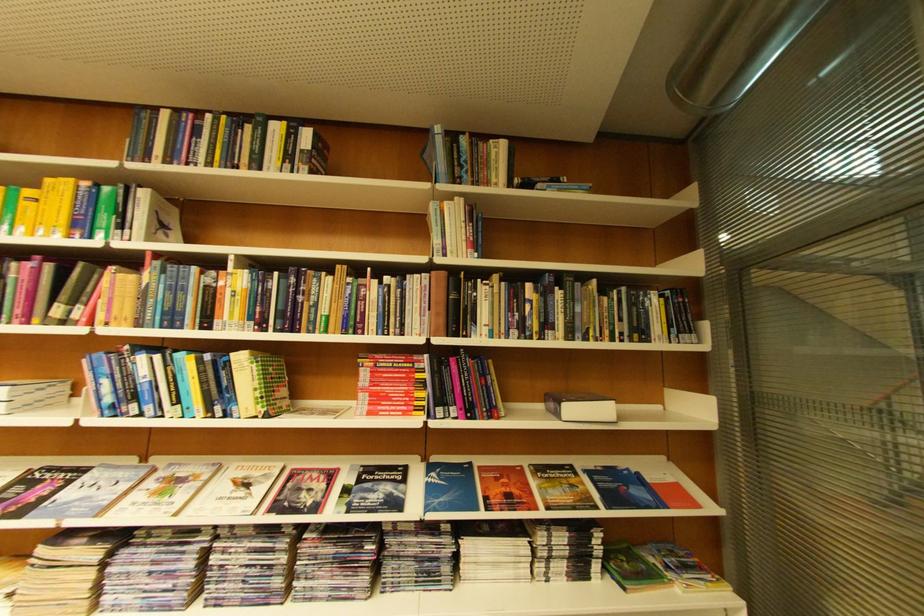
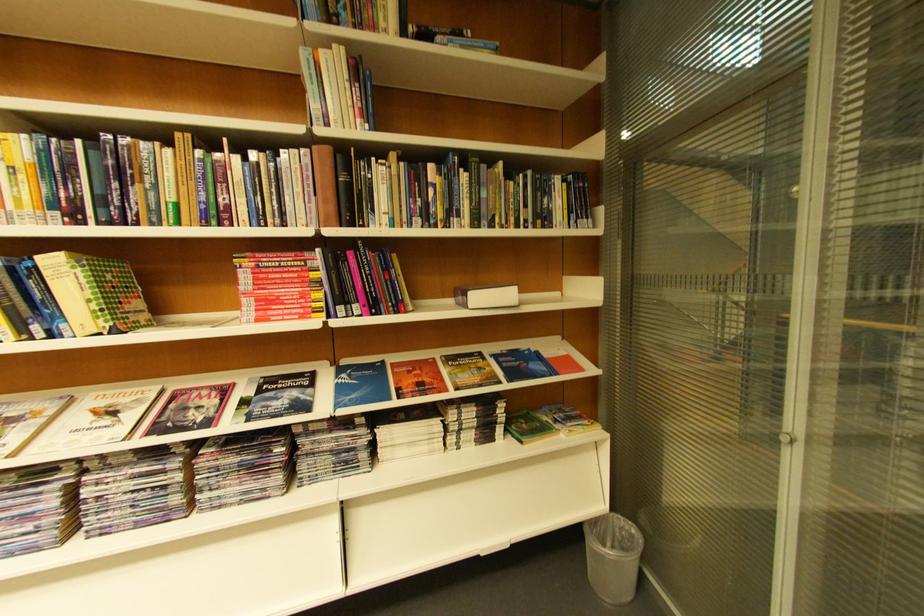
In the second image, find the point that corresponds to pixel 251 360 in the first image.

(63, 264)